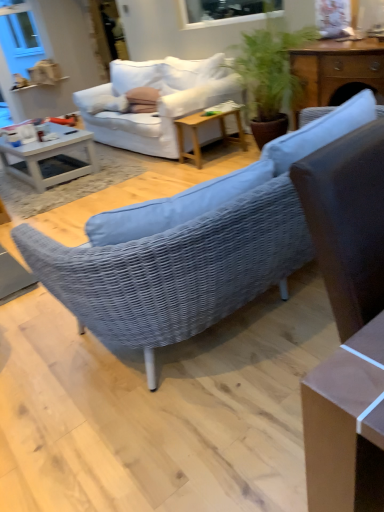
Question: In which direction should I rotate to look at white plastic window screen at upper center?

Choices:
 (A) right
 (B) left

Answer: (A)

Question: Is wooden side table at center, the 1th table when ordered from left to right, at the left side of woven fabric studio couch at center, the first studio couch in the left-to-right sequence?

Choices:
 (A) no
 (B) yes

Answer: (A)

Question: Could you tell me if wooden side table at center, the 1th table when ordered from left to right, is turned towards woven fabric studio couch at center, which is counted as the second studio couch, starting from the right?

Choices:
 (A) yes
 (B) no

Answer: (B)

Question: From a real-world perspective, is wooden side table at center, marked as the first table in a back-to-front arrangement, physically above woven fabric studio couch at center, which is counted as the second studio couch, starting from the right?

Choices:
 (A) no
 (B) yes

Answer: (B)

Question: Is wooden side table at center, the 1th table when ordered from left to right, beside woven fabric studio couch at center, the first studio couch in the left-to-right sequence?

Choices:
 (A) no
 (B) yes

Answer: (A)

Question: Is wooden side table at center, the 1th table when ordered from left to right, turned away from woven fabric studio couch at center, which is counted as the second studio couch, starting from the right?

Choices:
 (A) yes
 (B) no

Answer: (B)

Question: Considering the relative sizes of wooden side table at center, the 1th table when ordered from left to right, and woven fabric studio couch at center, the first studio couch in the left-to-right sequence, in the image provided, is wooden side table at center, the 1th table when ordered from left to right, taller than woven fabric studio couch at center, the first studio couch in the left-to-right sequence,?

Choices:
 (A) yes
 (B) no

Answer: (A)

Question: Does matte pink pillow at center appear on the right side of wooden side table at center, the 1th table when ordered from left to right?

Choices:
 (A) no
 (B) yes

Answer: (A)

Question: Does matte pink pillow at center have a greater width compared to wooden side table at center, which is the second table from right to left?

Choices:
 (A) yes
 (B) no

Answer: (B)

Question: Are matte pink pillow at center and wooden side table at center, marked as the first table in a back-to-front arrangement, located far from each other?

Choices:
 (A) no
 (B) yes

Answer: (A)

Question: Is matte pink pillow at center oriented away from wooden side table at center, which is counted as the 2th table, starting from the front?

Choices:
 (A) yes
 (B) no

Answer: (B)

Question: Can you confirm if matte pink pillow at center is shorter than wooden side table at center, the 1th table when ordered from left to right?

Choices:
 (A) yes
 (B) no

Answer: (A)

Question: Is wooden side table at center, which is the second table from right to left, located within matte pink pillow at center?

Choices:
 (A) no
 (B) yes

Answer: (A)

Question: From the image's perspective, would you say woven fabric studio couch at center, which is counted as the second studio couch, starting from the right, is shown under white glossy coffee table at left?

Choices:
 (A) no
 (B) yes

Answer: (B)